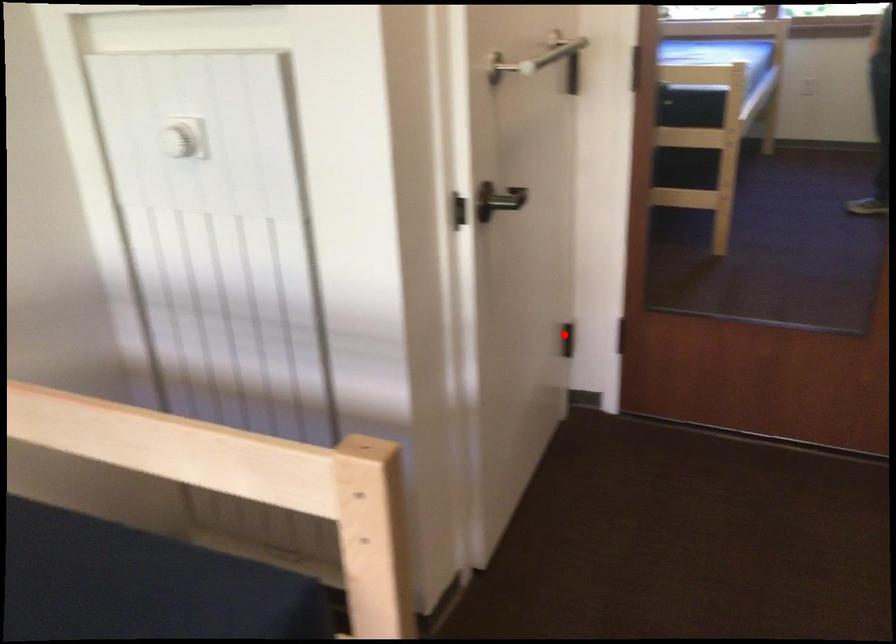
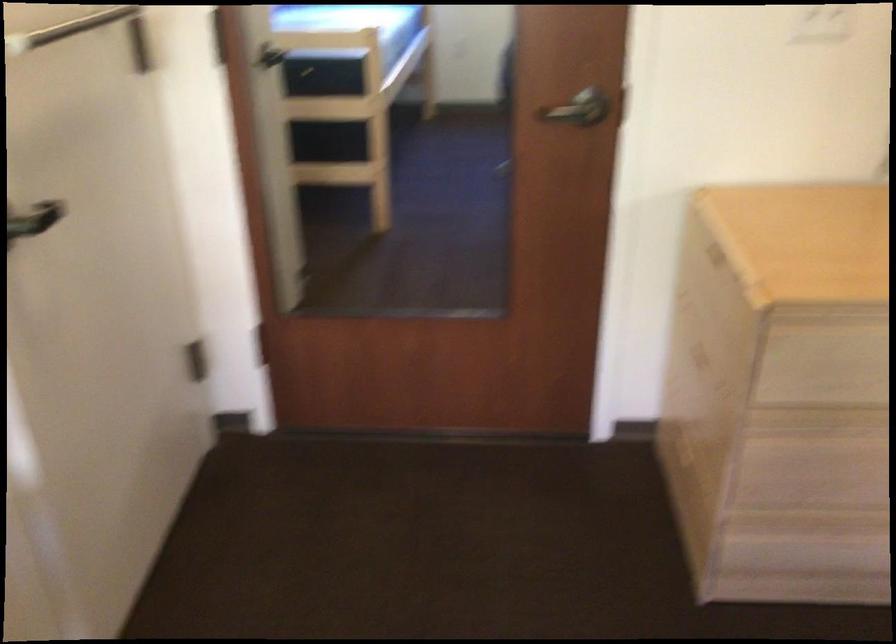
Question: I am providing you with two images of the same scene from different viewpoints. Given a red point in image1, look at the same physical point in image2. Is it:

Choices:
 (A) Closer to the viewpoint
 (B) Farther from the viewpoint

Answer: (A)